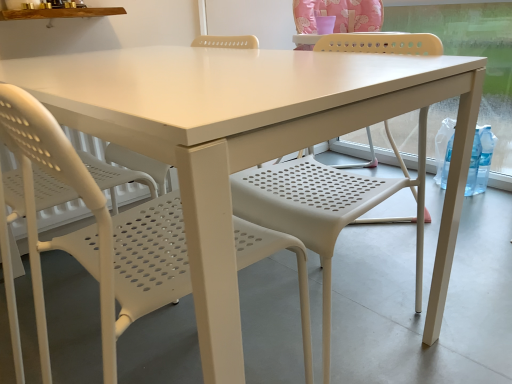
Identify the location of free space to the back side of white perforated plastic chair at left. (170, 316).